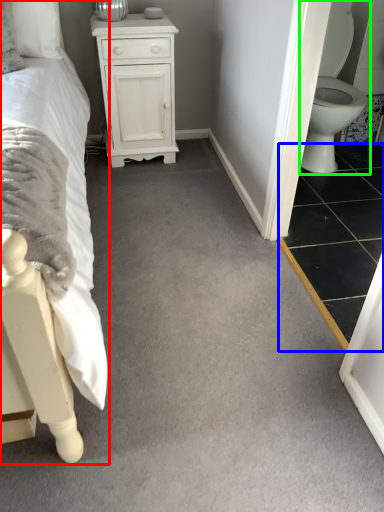
Question: Estimate the real-world distances between objects in this image. Which object is closer to bed (highlighted by a red box), tile (highlighted by a blue box) or toilet (highlighted by a green box)?

Choices:
 (A) tile
 (B) toilet

Answer: (A)